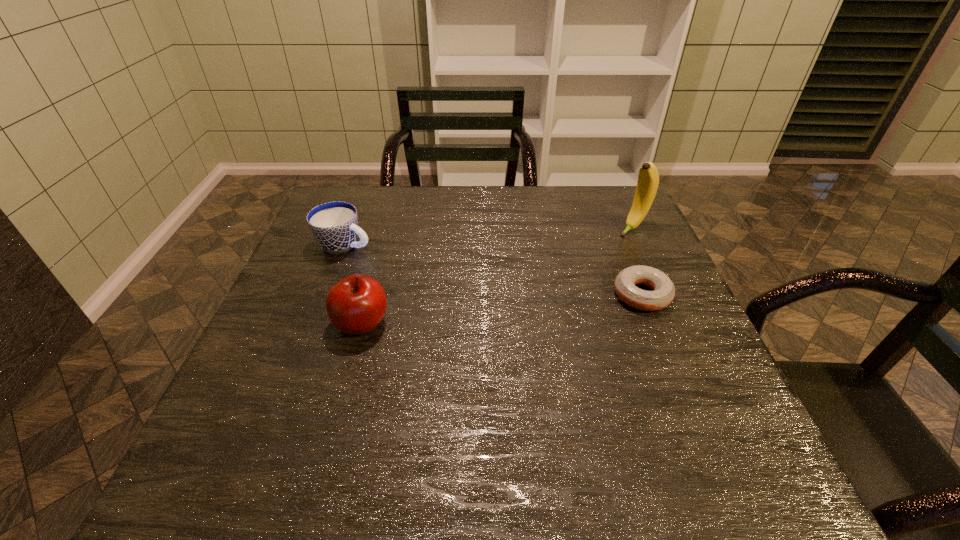
Where is `free space that is in between the banana and the apple`? Image resolution: width=960 pixels, height=540 pixels. free space that is in between the banana and the apple is located at coordinates (x=497, y=276).

Locate an element on the screen. vacant area between the shortest object and the tallest object is located at coordinates (637, 261).

Identify the location of free space between the cup and the banana. (489, 237).

Locate which object is the second closest to the third tallest object. Please provide its 2D coordinates. Your answer should be formatted as a tuple, i.e. [(x, y)], where the tuple contains the x and y coordinates of a point satisfying the conditions above.

[(664, 291)]

This screenshot has width=960, height=540. I want to click on object that is the second closest to the cup, so click(x=664, y=291).

The height and width of the screenshot is (540, 960). In order to click on vacant space that satisfies the following two spatial constraints: 1. on the front side of the third tallest object; 2. on the left side of the apple in this screenshot , I will do `click(315, 323)`.

Locate an element on the screen. This screenshot has height=540, width=960. free location that satisfies the following two spatial constraints: 1. on the front side of the apple; 2. on the right side of the cup is located at coordinates (315, 323).

At what (x,y) coordinates should I click in order to perform the action: click on free region that satisfies the following two spatial constraints: 1. on the back side of the third tallest object; 2. on the left side of the banana. Please return your answer as a coordinate pair (x, y). Looking at the image, I should click on click(x=351, y=228).

Where is `free space that satisfies the following two spatial constraints: 1. on the back side of the second shortest object; 2. on the left side of the tallest object`? free space that satisfies the following two spatial constraints: 1. on the back side of the second shortest object; 2. on the left side of the tallest object is located at coordinates (351, 228).